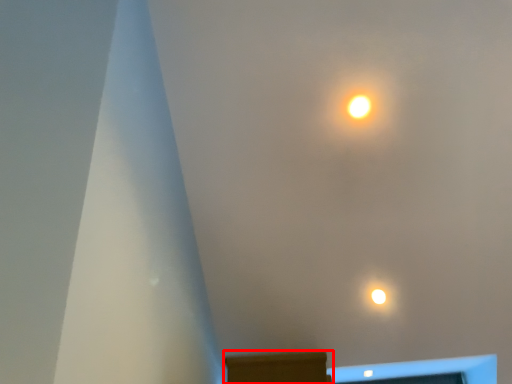
Question: From the image's perspective, what is the correct spatial positioning of furniture (annotated by the red box) in reference to lamp?

Choices:
 (A) below
 (B) above

Answer: (A)